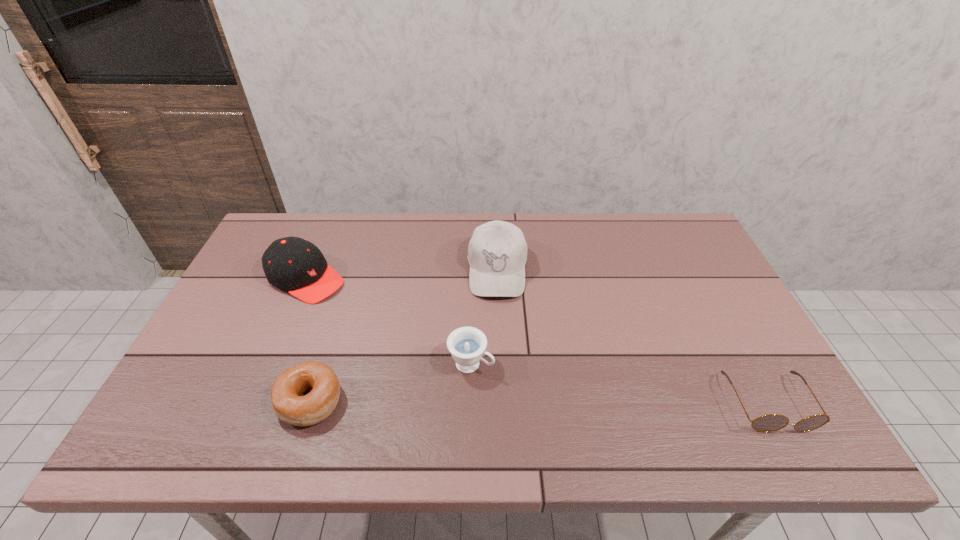
Where is `bagel`? bagel is located at coordinates (318, 378).

This screenshot has width=960, height=540. I want to click on sunglasses, so click(x=772, y=422).

Find the location of a particular element. This screenshot has height=540, width=960. the fourth shortest object is located at coordinates (293, 264).

This screenshot has height=540, width=960. Identify the location of baseball cap. (497, 252).

Image resolution: width=960 pixels, height=540 pixels. I want to click on teacup, so click(x=466, y=344).

I want to click on free space located on the back of the bagel, so click(x=329, y=339).

Identify the location of vacant space located on the front-facing side of the fourth shortest object. Image resolution: width=960 pixels, height=540 pixels. (402, 334).

What are the coordinates of `vacant space situated on the front-facing side of the fourth shortest object` in the screenshot? It's located at (375, 318).

Where is `free space located 0.180m on the front-facing side of the fourth shortest object`? The image size is (960, 540). free space located 0.180m on the front-facing side of the fourth shortest object is located at coordinates (378, 320).

Identify the location of vacant space located 0.210m on the front-facing side of the baseball cap. The image size is (960, 540). (497, 362).